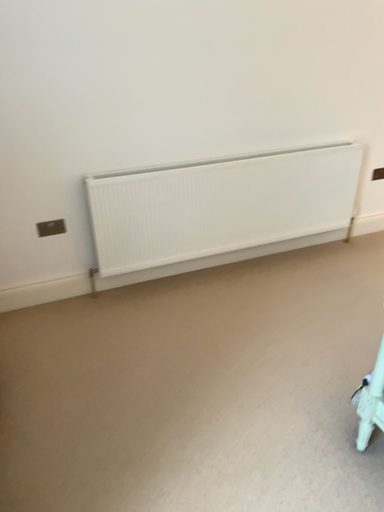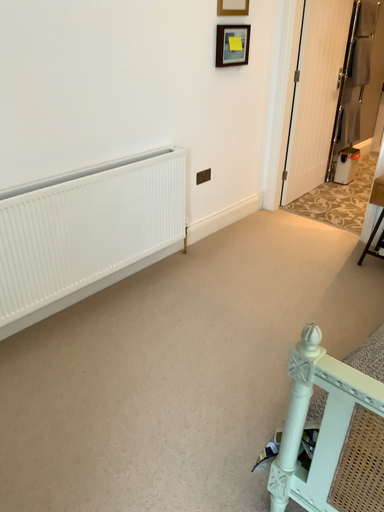
Question: How did the camera likely rotate when shooting the video?

Choices:
 (A) rotated right
 (B) rotated left

Answer: (A)